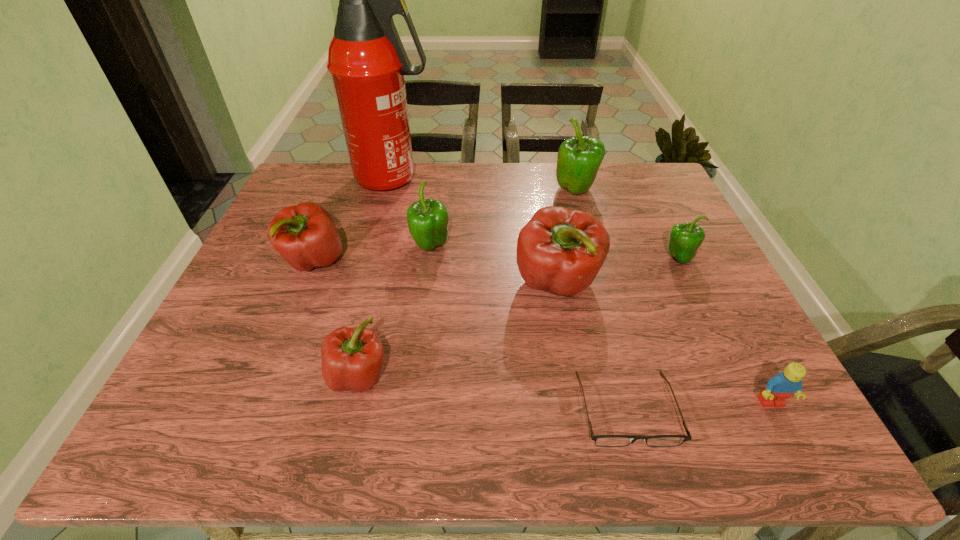
This screenshot has height=540, width=960. Find the location of `the tallest object`. the tallest object is located at coordinates (366, 58).

I want to click on red fire extinguisher, so click(366, 58).

Locate an element on the screen. the farthest bell pepper is located at coordinates (578, 161).

What are the coordinates of `the second green bell pepper from right to left` in the screenshot? It's located at coord(578,161).

Where is `the rightmost pink bell pepper`? The height and width of the screenshot is (540, 960). the rightmost pink bell pepper is located at coordinates (559, 250).

Find the location of a particular element. The height and width of the screenshot is (540, 960). the leftmost green bell pepper is located at coordinates (428, 219).

Find the location of a particular element. The width and height of the screenshot is (960, 540). the second biggest pink bell pepper is located at coordinates (305, 235).

The width and height of the screenshot is (960, 540). What are the coordinates of `the leftmost pink bell pepper` in the screenshot? It's located at (305, 235).

At what (x,y) coordinates should I click in order to perform the action: click on the rightmost green bell pepper. Please return your answer as a coordinate pair (x, y). This screenshot has width=960, height=540. Looking at the image, I should click on (684, 240).

Find the location of a particular element. This screenshot has width=960, height=540. the rightmost bell pepper is located at coordinates (684, 240).